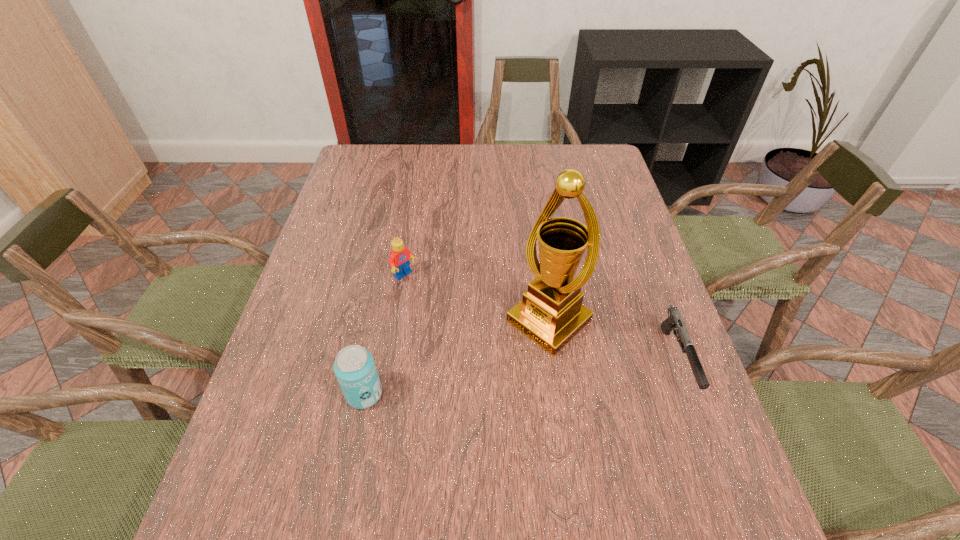
Where is `vacant point located between the shortest object and the beer can`? vacant point located between the shortest object and the beer can is located at coordinates (520, 377).

Where is `free spot between the beer can and the award`? The width and height of the screenshot is (960, 540). free spot between the beer can and the award is located at coordinates (457, 357).

Locate which object is the second closest to the beer can. Please provide its 2D coordinates. Your answer should be formatted as a tuple, i.e. [(x, y)], where the tuple contains the x and y coordinates of a point satisfying the conditions above.

[(551, 313)]

Locate an element on the screen. The image size is (960, 540). the third closest object relative to the award is located at coordinates (354, 366).